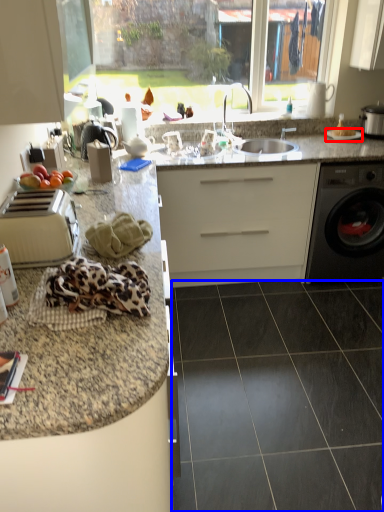
Question: Which object is closer to the camera taking this photo, gas stove (highlighted by a red box) or granite (highlighted by a blue box)?

Choices:
 (A) gas stove
 (B) granite

Answer: (B)